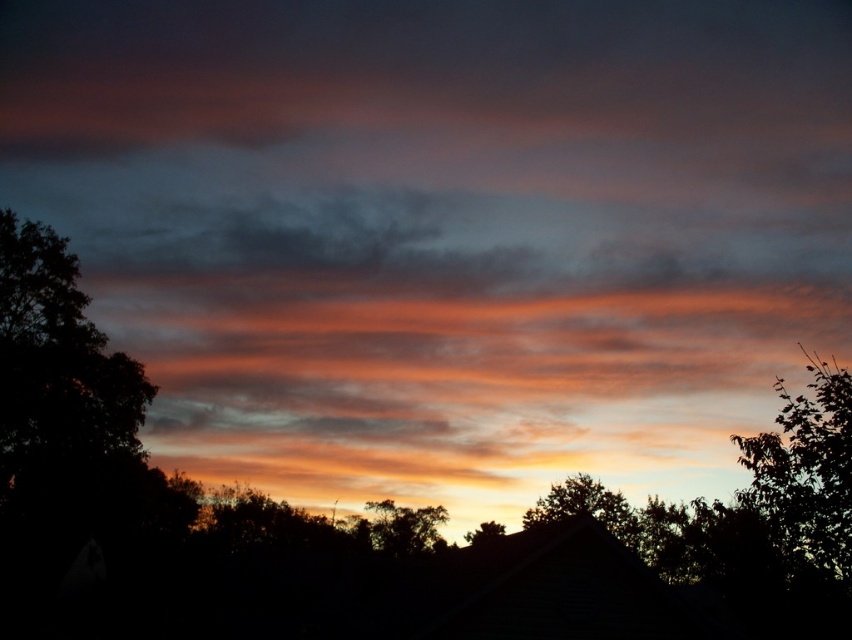
You are an artist drawing the sunset scene. You need to place the silhouette leafy tree at center and the silvery metallic tree at center in your drawing. According to the scene, which tree should be drawn lower on the paper?

The silhouette leafy tree at center should be drawn lower on the paper because it is located below the silvery metallic tree at center in the image.

Consider the image. You are standing in the sunset scene and want to walk from the point closer to you to the farther point. Which path would you take between the two points, point (784, 396) and point (417, 516)?

You should walk from point (784, 396) to point (417, 516) because point (784, 396) is closer to the viewer and the other is farther away.

You are standing in the middle of the scene and want to walk towards the silvery metallic tree at center. Which direction should you walk to avoid the dark green leafy tree at left?

You should walk directly towards the silvery metallic tree at center since the dark green leafy tree at left is positioned over it, meaning it is closer to you and blocking the path. To avoid it, move sideways away from the dark green leafy tree at left while heading toward the silvery metallic tree at center.